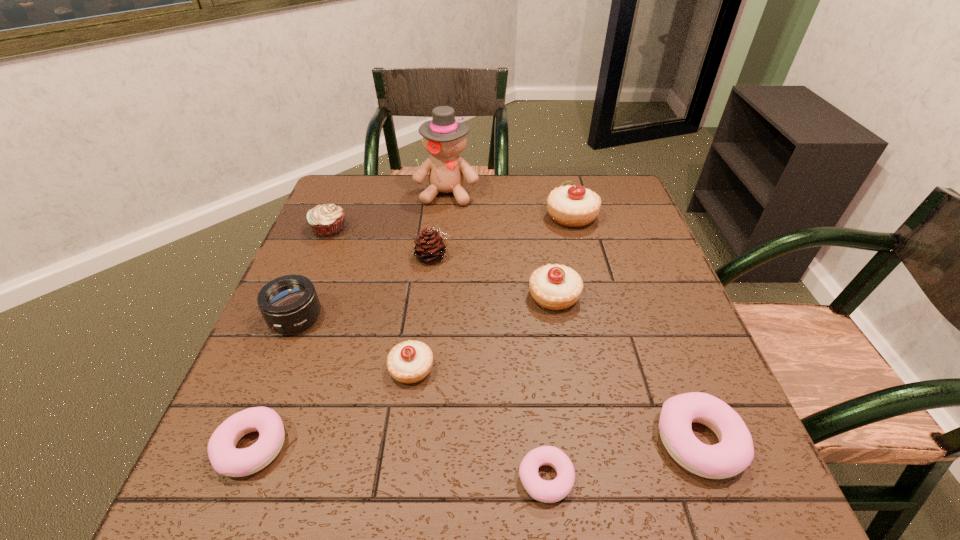
You are a GUI agent. You are given a task and a screenshot of the screen. Output one action in this format:
    pyautogui.click(x=<x>, y=<y>)
    Task: Click on the vacant space situated on the left of the second farthest pastry
    The image size is (960, 540).
    Given the screenshot: What is the action you would take?
    pyautogui.click(x=498, y=296)

Where is `vacant area situated 0.230m on the right of the muffin`? This screenshot has width=960, height=540. vacant area situated 0.230m on the right of the muffin is located at coordinates (431, 229).

Identify the location of blank space located on the side of the telephoto lens with brand markings and control switches. (269, 383).

Find the location of a particular element. The width and height of the screenshot is (960, 540). vacant space located 0.370m on the back of the fourth shortest object is located at coordinates coord(429,239).

The width and height of the screenshot is (960, 540). Find the location of `free location located on the left of the third shortest object`. free location located on the left of the third shortest object is located at coordinates (582, 441).

Image resolution: width=960 pixels, height=540 pixels. I want to click on vacant position located on the back of the leftmost pastry, so click(320, 274).

Locate an element on the screen. free space located on the right of the smallest pink pastry is located at coordinates (641, 478).

I want to click on rag_doll present at the far edge, so [444, 138].

This screenshot has height=540, width=960. In order to click on pastry located in the far edge section of the desktop in this screenshot , I will do `click(573, 206)`.

At what (x,y) coordinates should I click in order to perform the action: click on muffin situated at the far edge. Please return your answer as a coordinate pair (x, y). The width and height of the screenshot is (960, 540). Looking at the image, I should click on coord(327,220).